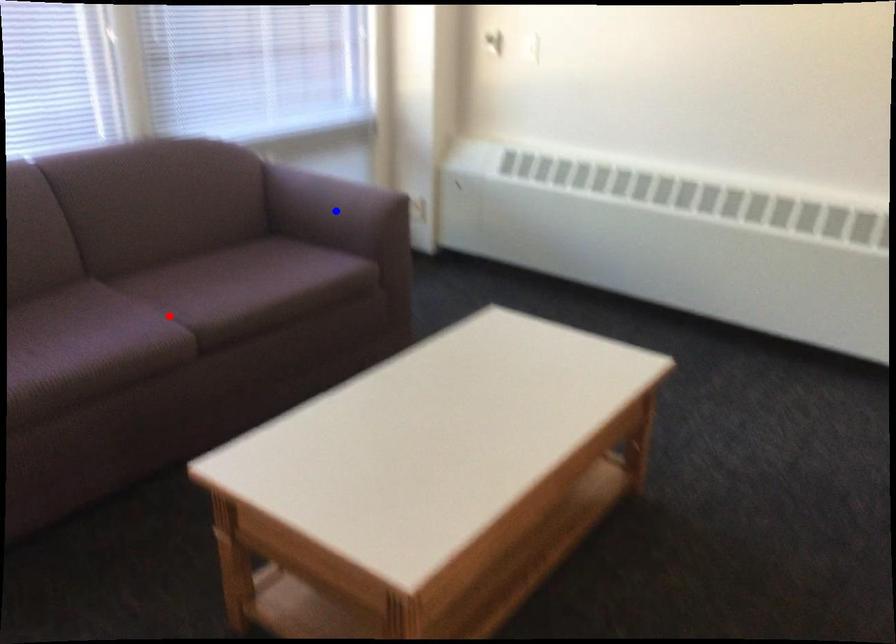
Question: Which of the two points in the image is closer to the camera?

Choices:
 (A) Blue point is closer.
 (B) Red point is closer.

Answer: (B)